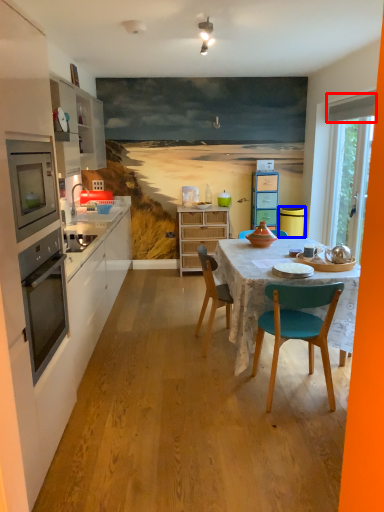
Question: Which object is closer to the camera taking this photo, exhaust hood (highlighted by a red box) or trash bin/can (highlighted by a blue box)?

Choices:
 (A) exhaust hood
 (B) trash bin/can

Answer: (A)